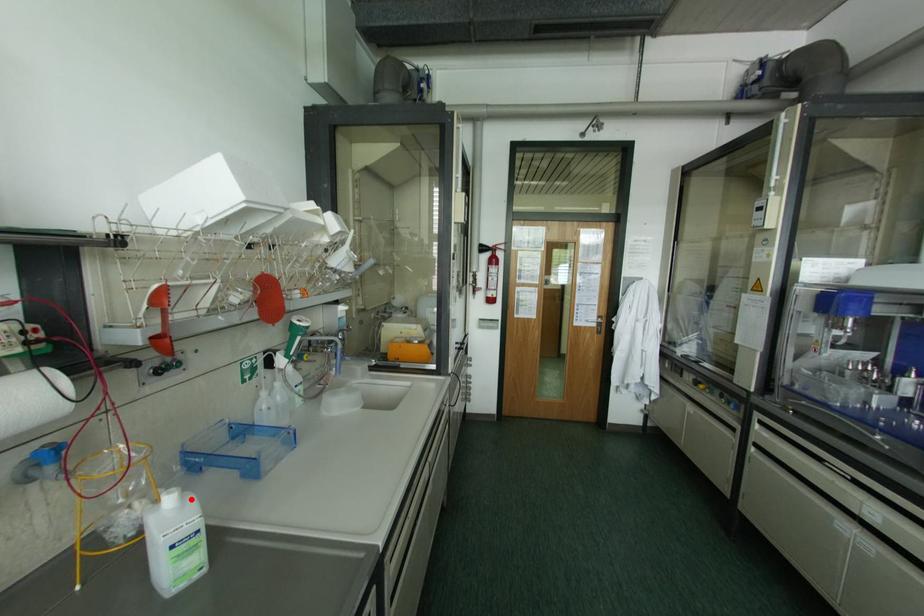
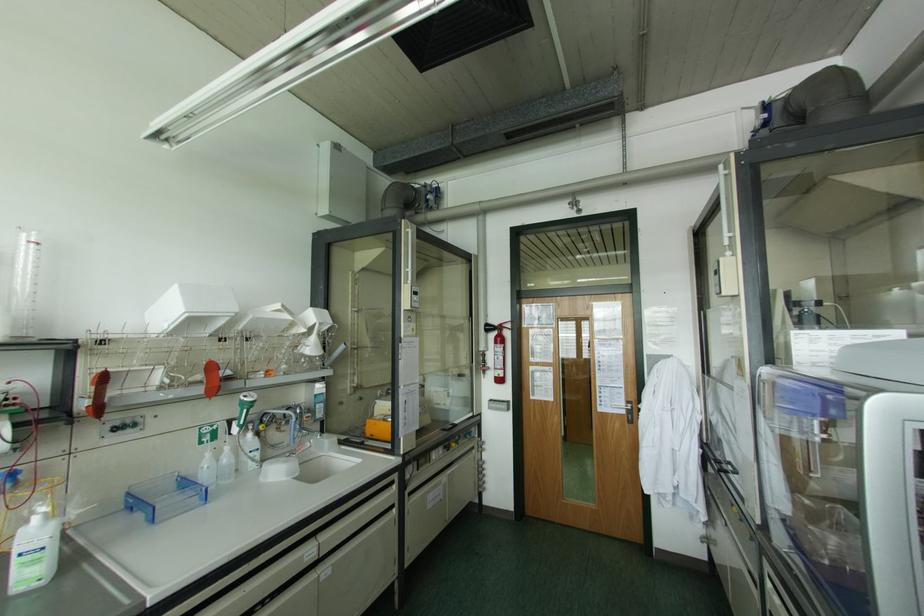
Question: I am providing you with two images of the same scene from different viewpoints. A red point is shown in image1. For the corresponding object point in image2, is it positioned nearer or farther from the camera?

Choices:
 (A) Nearer
 (B) Farther

Answer: (A)